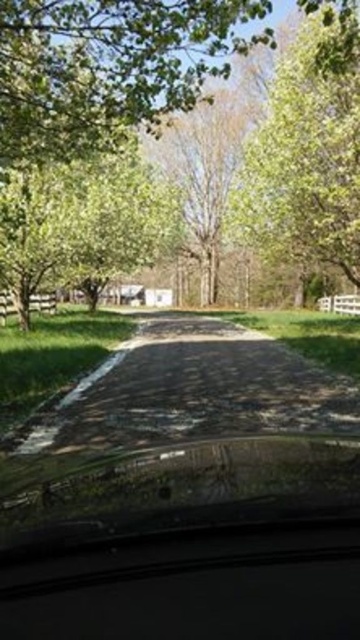
Question: Estimate the real-world distances between objects in this image. Which object is closer to the green leafy tree at center?

Choices:
 (A) green leafy tree at upper center
 (B) dark asphalt driveway at center

Answer: (A)

Question: Which point is closer to the camera?

Choices:
 (A) (15, 26)
 (B) (165, 401)
 (C) (331, 76)

Answer: (A)

Question: Can you confirm if green leafy tree at center is thinner than dark asphalt driveway at center?

Choices:
 (A) yes
 (B) no

Answer: (B)

Question: Can you confirm if dark asphalt driveway at center is positioned to the left of green leafy tree at upper center?

Choices:
 (A) yes
 (B) no

Answer: (A)

Question: Estimate the real-world distances between objects in this image. Which object is closer to the dark asphalt driveway at center?

Choices:
 (A) green leafy tree at center
 (B) green leafy tree at upper center

Answer: (A)

Question: Can you confirm if dark asphalt driveway at center is positioned to the right of green leafy tree at upper center?

Choices:
 (A) yes
 (B) no

Answer: (B)